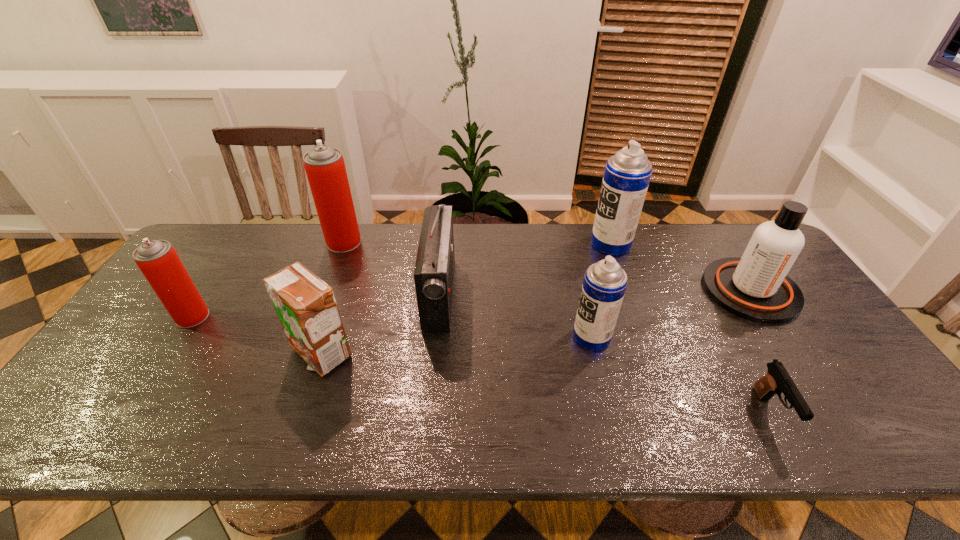
Where is `free space located 0.400m on the label side of the nearer blue aerosol can`? The image size is (960, 540). free space located 0.400m on the label side of the nearer blue aerosol can is located at coordinates (421, 337).

This screenshot has width=960, height=540. I want to click on free space located on the label side of the nearer blue aerosol can, so click(550, 337).

Locate an element on the screen. The width and height of the screenshot is (960, 540). free spot located 0.330m on the right of the leftmost aerosol can is located at coordinates (327, 316).

At what (x,y) coordinates should I click in order to perform the action: click on vacant space located 0.150m on the straw side of the carton. Please return your answer as a coordinate pair (x, y). This screenshot has width=960, height=540. Looking at the image, I should click on (293, 437).

Locate an element on the screen. radio receiver that is positioned at the far edge is located at coordinates (434, 270).

The width and height of the screenshot is (960, 540). Identify the location of cleansing agent that is at the far edge. (755, 287).

Locate an element on the screen. Image resolution: width=960 pixels, height=540 pixels. object present at the near edge is located at coordinates (777, 380).

The image size is (960, 540). I want to click on object located at the left edge, so click(x=157, y=259).

Locate an element on the screen. The width and height of the screenshot is (960, 540). object that is at the right edge is located at coordinates (755, 287).

The width and height of the screenshot is (960, 540). I want to click on object located at the far right corner, so click(x=755, y=287).